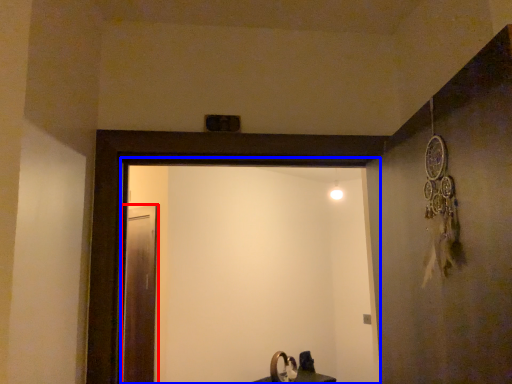
Question: Which object appears farthest to the camera in this image, screen door (highlighted by a red box) or screen door (highlighted by a blue box)?

Choices:
 (A) screen door
 (B) screen door

Answer: (A)